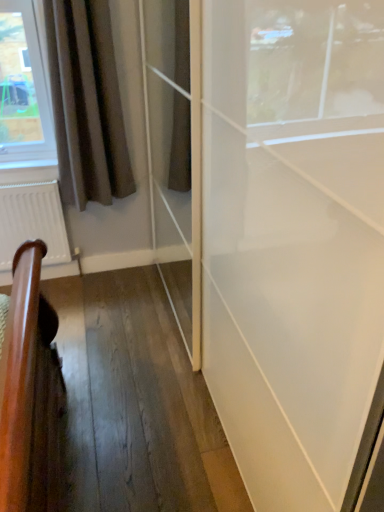
At what (x,y) coordinates should I click in order to perform the action: click on spots to the right of white matte radiator at lower left. Please return your answer as a coordinate pair (x, y). Looking at the image, I should click on (82, 289).